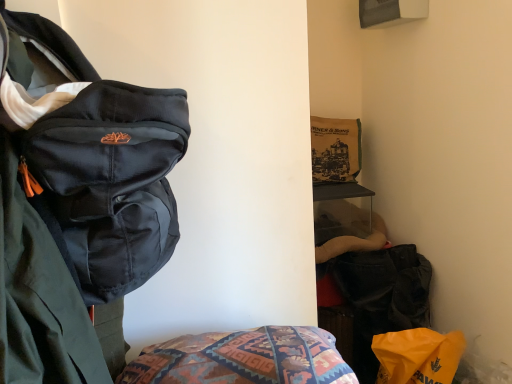
Question: From the image's perspective, is velvet black bag at lower right located above matte black backpack at left?

Choices:
 (A) no
 (B) yes

Answer: (A)

Question: Considering the relative sizes of velvet black bag at lower right and matte black backpack at left in the image provided, is velvet black bag at lower right shorter than matte black backpack at left?

Choices:
 (A) yes
 (B) no

Answer: (A)

Question: Does velvet black bag at lower right have a smaller size compared to matte black backpack at left?

Choices:
 (A) yes
 (B) no

Answer: (A)

Question: Considering the relative sizes of velvet black bag at lower right and matte black backpack at left in the image provided, is velvet black bag at lower right thinner than matte black backpack at left?

Choices:
 (A) yes
 (B) no

Answer: (A)

Question: Does velvet black bag at lower right have a greater width compared to matte black backpack at left?

Choices:
 (A) yes
 (B) no

Answer: (B)

Question: Is velvet black bag at lower right positioned far away from matte black backpack at left?

Choices:
 (A) no
 (B) yes

Answer: (B)

Question: From the image's perspective, is orange plastic bag at lower right located above velvet black bag at lower right?

Choices:
 (A) yes
 (B) no

Answer: (B)

Question: From a real-world perspective, is orange plastic bag at lower right physically above velvet black bag at lower right?

Choices:
 (A) yes
 (B) no

Answer: (B)

Question: From a real-world perspective, is orange plastic bag at lower right positioned under velvet black bag at lower right based on gravity?

Choices:
 (A) yes
 (B) no

Answer: (A)

Question: Can you confirm if orange plastic bag at lower right is taller than velvet black bag at lower right?

Choices:
 (A) no
 (B) yes

Answer: (A)

Question: Are orange plastic bag at lower right and velvet black bag at lower right making contact?

Choices:
 (A) yes
 (B) no

Answer: (B)

Question: Is orange plastic bag at lower right aimed at velvet black bag at lower right?

Choices:
 (A) yes
 (B) no

Answer: (B)

Question: Is matte black backpack at left positioned far away from velvet black bag at lower right?

Choices:
 (A) no
 (B) yes

Answer: (B)